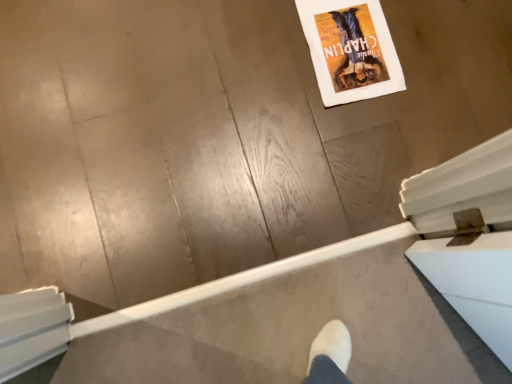
Find the location of a particular element. The width and height of the screenshot is (512, 384). free location in front of white paper towel at upper center is located at coordinates (349, 134).